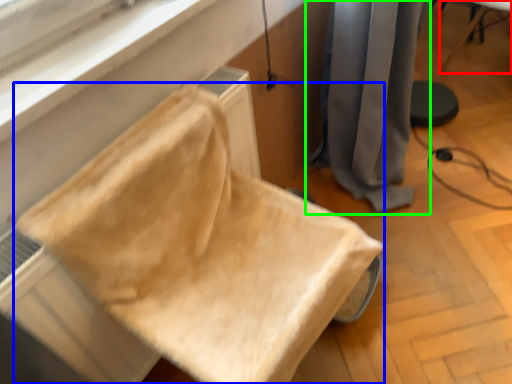
Question: Which is farther away from furniture (highlighted by a red box)? furniture (highlighted by a blue box) or curtain (highlighted by a green box)?

Choices:
 (A) furniture
 (B) curtain

Answer: (A)